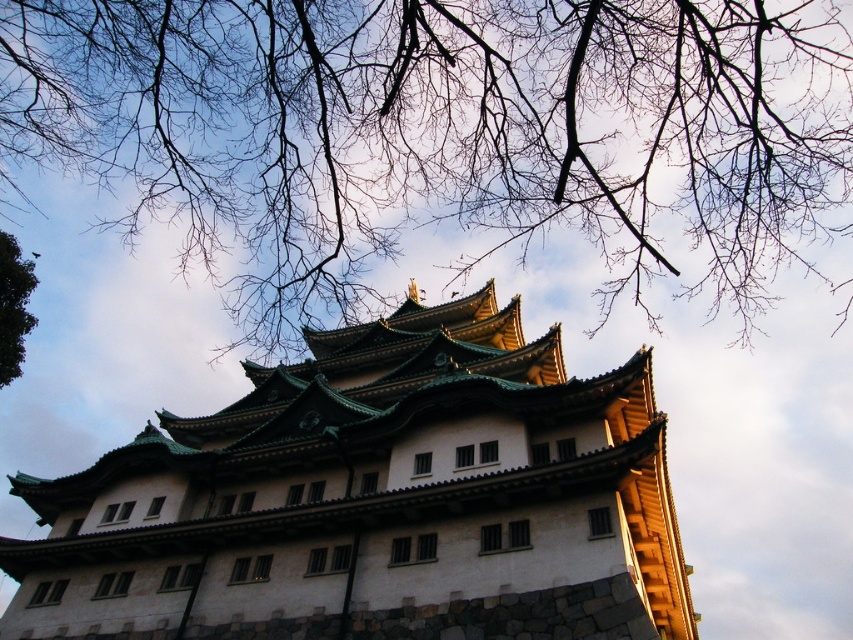
Is point (45, 637) closer to viewer compared to point (0, 326)?

Yes, point (45, 637) is in front of point (0, 326).

Describe the element at coordinates (374, 500) in the screenshot. The width and height of the screenshot is (853, 640). I see `white stone tower at center` at that location.

You are a GUI agent. You are given a task and a screenshot of the screen. Output one action in this format:
    pyautogui.click(x=<x>, y=<y>)
    Task: Click on the white stone tower at center
    
    Given the screenshot: What is the action you would take?
    pyautogui.click(x=374, y=500)

Does brown bark tree at upper center appear on the left side of green leafy tree at upper left?

No, brown bark tree at upper center is not to the left of green leafy tree at upper left.

Does brown bark tree at upper center come in front of green leafy tree at upper left?

Yes, it is in front of green leafy tree at upper left.

Which is in front, point (577, 1) or point (28, 317)?

Point (577, 1)

Image resolution: width=853 pixels, height=640 pixels. What are the coordinates of `brown bark tree at upper center` in the screenshot? It's located at (440, 129).

Is point (213, 141) closer to camera compared to point (490, 376)?

No, (213, 141) is further to viewer.

Who is lower down, brown bark tree at upper center or white stone tower at center?

white stone tower at center

Locate an element on the screen. brown bark tree at upper center is located at coordinates (440, 129).